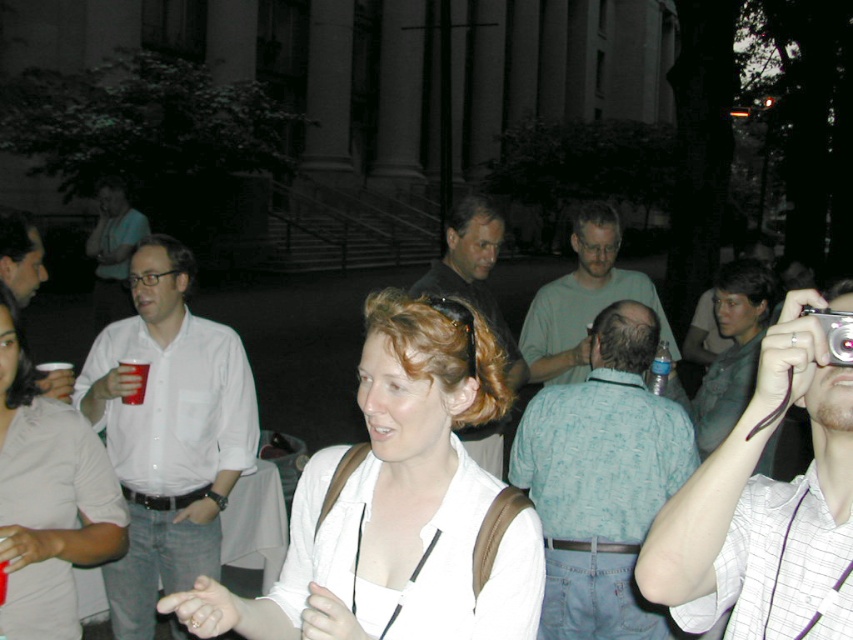
Does light blue printed shirt at center have a larger size compared to matte green shirt at center?

Yes.

Can you confirm if light blue printed shirt at center is thinner than matte green shirt at center?

In fact, light blue printed shirt at center might be wider than matte green shirt at center.

Identify the location of light blue printed shirt at center. (601, 480).

Where is `light blue printed shirt at center`? Image resolution: width=853 pixels, height=640 pixels. light blue printed shirt at center is located at coordinates (601, 480).

Consider the image. Does light blue printed shirt at center have a greater width compared to silver metallic camera at upper right?

Yes.

Identify the location of light blue printed shirt at center. The image size is (853, 640). (601, 480).

Which is behind, point (544, 458) or point (827, 326)?

Point (544, 458)

Where is `light blue printed shirt at center`? This screenshot has width=853, height=640. light blue printed shirt at center is located at coordinates (601, 480).

Does white checkered shirt at upper right have a smaller size compared to light blue textured shirt at upper right?

Yes.

Is white checkered shirt at upper right bigger than light blue textured shirt at upper right?

Actually, white checkered shirt at upper right might be smaller than light blue textured shirt at upper right.

Which is behind, point (831, 486) or point (714, 438)?

Positioned behind is point (714, 438).

At what (x,y) coordinates should I click in order to perform the action: click on white checkered shirt at upper right. Please return your answer as a coordinate pair (x, y). This screenshot has width=853, height=640. Looking at the image, I should click on (766, 506).